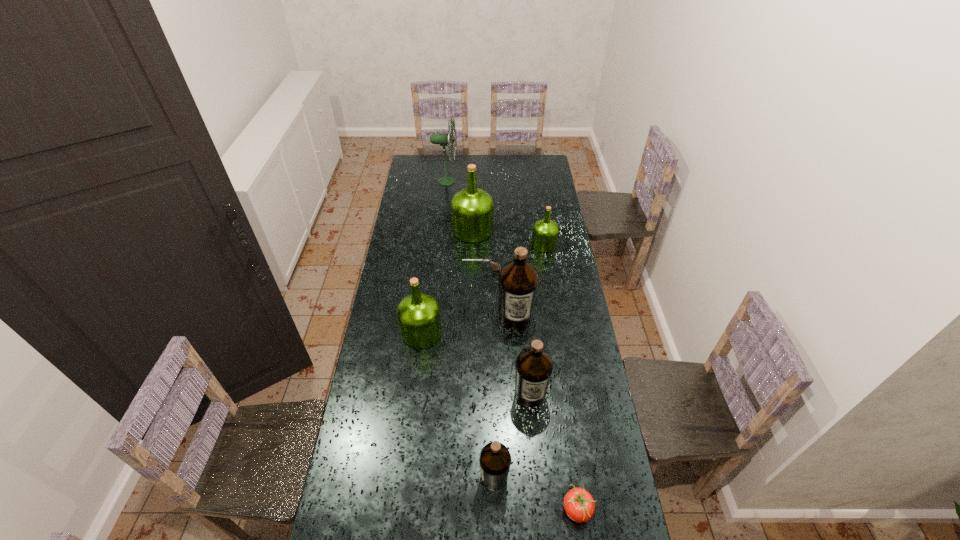
You are a GUI agent. You are given a task and a screenshot of the screen. Output one action in this format:
    pyautogui.click(x=<x>, y=<y>)
    Task: Click on the vacant space in between the green fan and the smallest green olive oil
    The image size is (960, 540).
    Given the screenshot: What is the action you would take?
    pyautogui.click(x=494, y=213)

The image size is (960, 540). Identify the location of unoccupied position between the biggest brown olive oil and the shortest object. (498, 294).

Locate an element on the screen. free space between the biggest brown olive oil and the nearest brown olive oil is located at coordinates (505, 397).

The height and width of the screenshot is (540, 960). What are the coordinates of `vacant space that is in between the second green olive oil from left to right and the gun` in the screenshot? It's located at (477, 250).

Choose which object is the third nearest neighbor to the tomato. Please provide its 2D coordinates. Your answer should be formatted as a tuple, i.e. [(x, y)], where the tuple contains the x and y coordinates of a point satisfying the conditions above.

[(518, 281)]

Where is `object that is the fourth closest one to the green fan`? The image size is (960, 540). object that is the fourth closest one to the green fan is located at coordinates (518, 281).

Point out which olive oil is positioned as the fourth nearest to the red tomato. Please provide its 2D coordinates. Your answer should be formatted as a tuple, i.e. [(x, y)], where the tuple contains the x and y coordinates of a point satisfying the conditions above.

[(418, 314)]

Point out which olive oil is positioned as the nearest to the smallest green olive oil. Please provide its 2D coordinates. Your answer should be formatted as a tuple, i.e. [(x, y)], where the tuple contains the x and y coordinates of a point satisfying the conditions above.

[(472, 209)]

Find the location of a particular element. brown olive oil that is the third closest one to the rightmost olive oil is located at coordinates (495, 459).

Identify which brown olive oil is located as the nearest to the sixth nearest object. Please provide its 2D coordinates. Your answer should be formatted as a tuple, i.e. [(x, y)], where the tuple contains the x and y coordinates of a point satisfying the conditions above.

[(518, 281)]